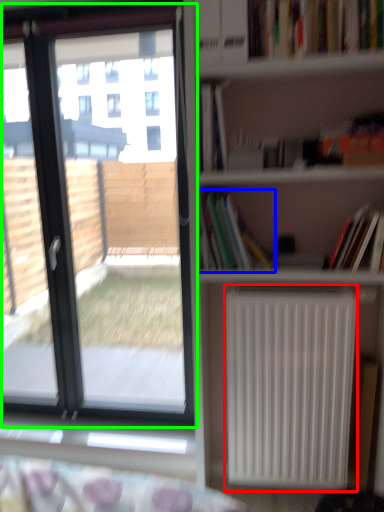
Question: Considering the real-world distances, which object is farthest from radiator (highlighted by a red box)? book (highlighted by a blue box) or window (highlighted by a green box)?

Choices:
 (A) book
 (B) window

Answer: (B)